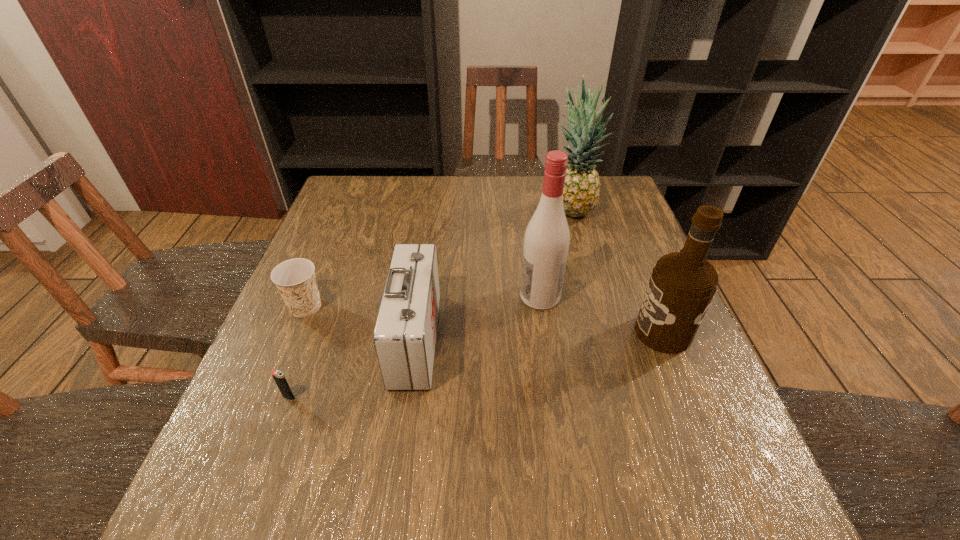
At what (x,y) coordinates should I click in order to perform the action: click on object that is positioned at the far edge. Please return your answer as a coordinate pair (x, y). Looking at the image, I should click on (582, 184).

In order to click on Dixie cup that is at the left edge in this screenshot , I will do `click(295, 279)`.

Where is `igniter that is positioned at the left edge`? The width and height of the screenshot is (960, 540). igniter that is positioned at the left edge is located at coordinates (x=278, y=376).

Where is `pineapple that is at the right edge`? This screenshot has height=540, width=960. pineapple that is at the right edge is located at coordinates (582, 184).

This screenshot has height=540, width=960. I want to click on alcohol positioned at the right edge, so click(682, 285).

Find the location of a particular element. The image size is (960, 540). object that is at the far right corner is located at coordinates (582, 184).

In the image, there is a desktop. Where is `free space at the far edge`? The height and width of the screenshot is (540, 960). free space at the far edge is located at coordinates (489, 199).

Locate an element on the screen. Image resolution: width=960 pixels, height=540 pixels. free point at the left edge is located at coordinates (357, 244).

The image size is (960, 540). In order to click on vacant space at the right edge of the desktop in this screenshot , I will do `click(626, 227)`.

The width and height of the screenshot is (960, 540). Identify the location of free area in between the pineapple and the first-aid kit. (493, 275).